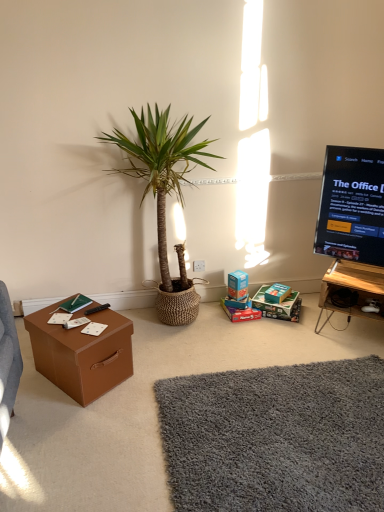
I want to click on free space between brown cardboard box at lower left and shaggy gray rug at lower center, which is the first plain in back-to-front order, so click(x=151, y=398).